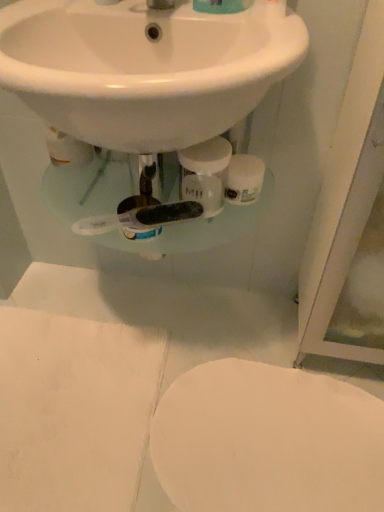
Find the location of a particular element. vacant space behind white glossy toilet at lower right is located at coordinates (223, 322).